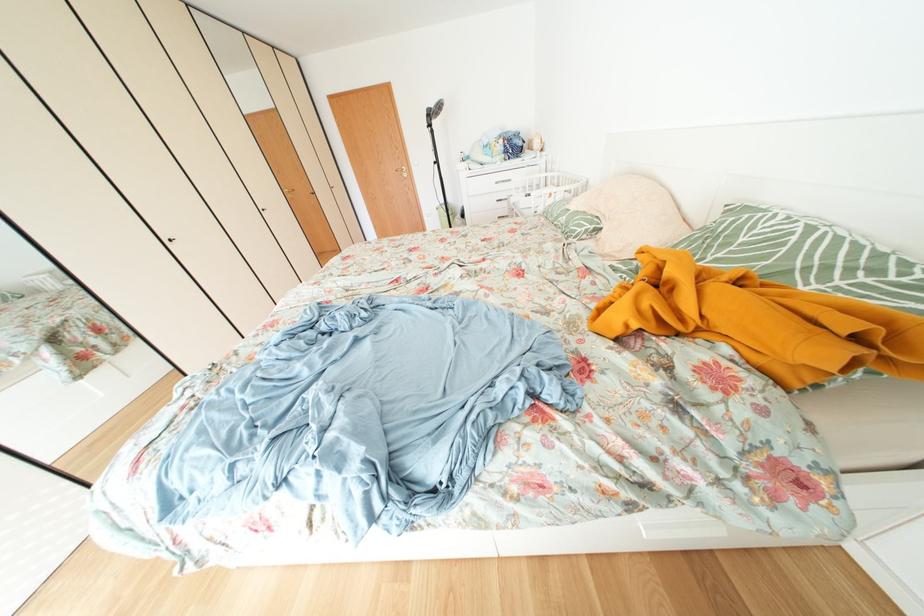
What do you see at coordinates (402, 171) in the screenshot? I see `the wooden door handle` at bounding box center [402, 171].